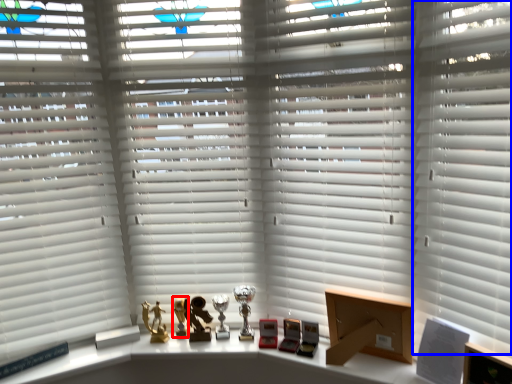
Question: Which point is closer to the camera, miniature (highlighted by a red box) or shutter (highlighted by a blue box)?

Choices:
 (A) miniature
 (B) shutter

Answer: (B)